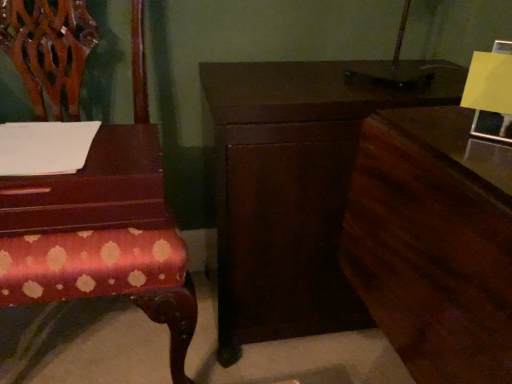
The width and height of the screenshot is (512, 384). In order to click on empty space that is ontop of mahogany wood table at left (from a real-world perspective) in this screenshot , I will do `click(52, 151)`.